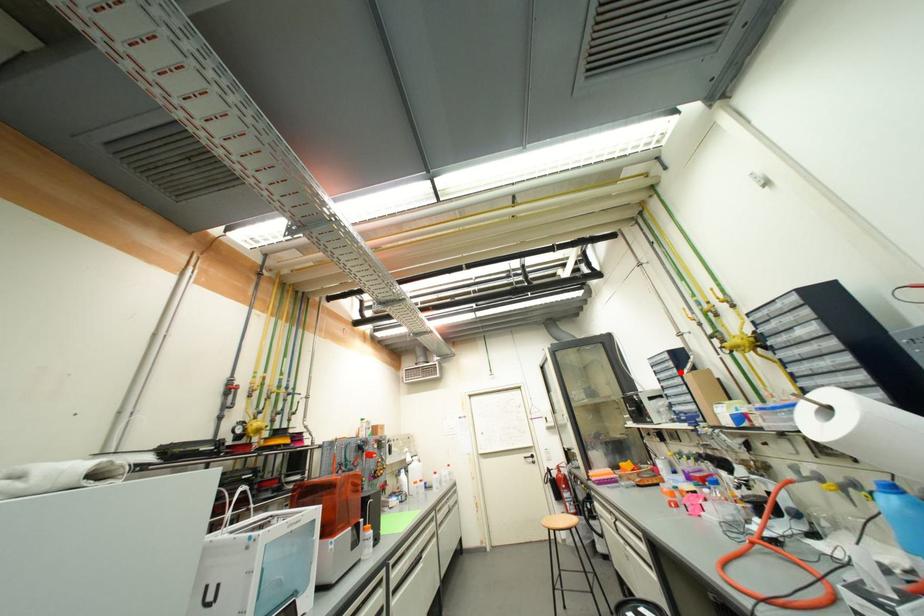
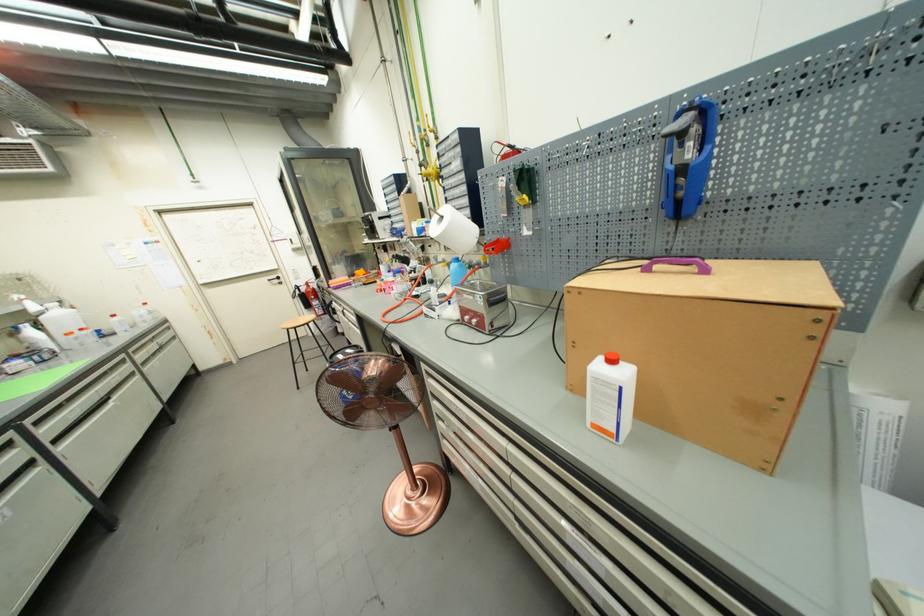
The point at the highlighted location is marked in the first image. Where is the corresponding point in the second image?

(402, 196)